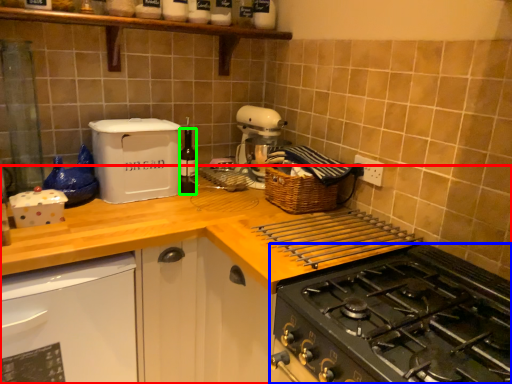
Question: Estimate the real-world distances between objects in this image. Which object is closer to countertop (highlighted by a red box), gas stove (highlighted by a blue box) or bottle (highlighted by a green box)?

Choices:
 (A) gas stove
 (B) bottle

Answer: (A)